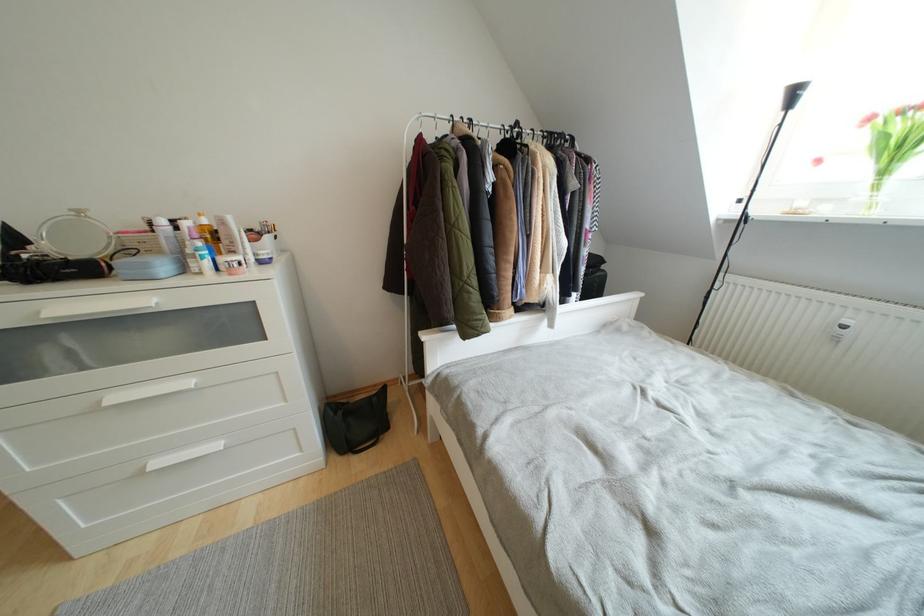
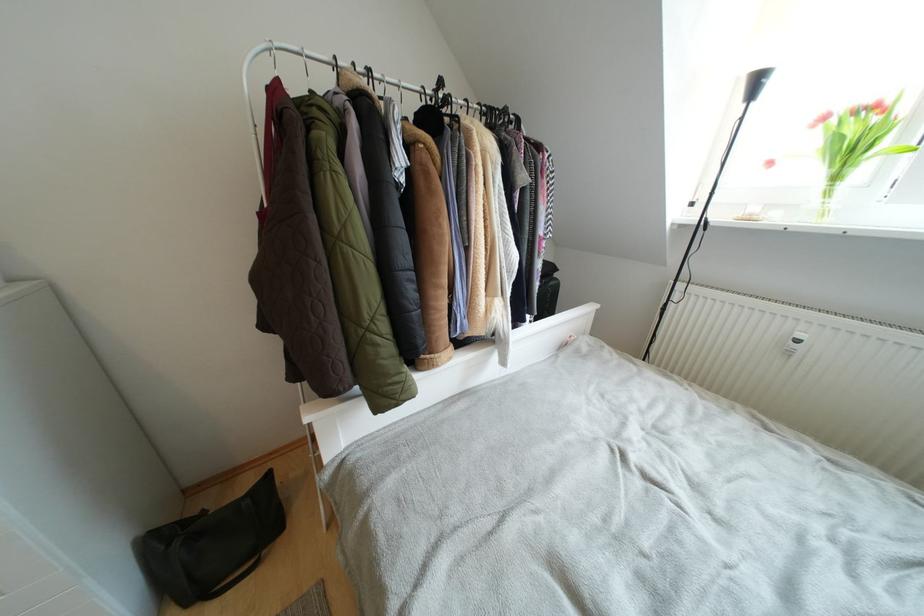
Find the pixel in the second image that matches pixel 341 416 in the first image.

(175, 549)